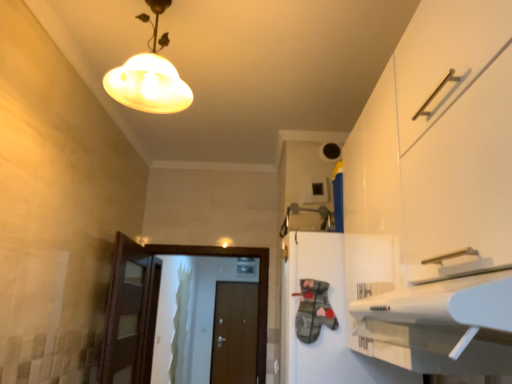
What is the approximate height of white matte cabinet at center?

It is 29.87 inches.

At what (x,y) coordinates should I click in order to perform the action: click on white matte cabinet at center. Please return your answer as a coordinate pair (x, y). Image resolution: width=512 pixels, height=384 pixels. Looking at the image, I should click on (325, 325).

Locate an element on the screen. matte glass lampshade at upper center is located at coordinates (149, 75).

Is white matte cabinet at center taller than white glossy door at center, which ranks as the first door in top-to-bottom order?

In fact, white matte cabinet at center may be shorter than white glossy door at center, which ranks as the first door in top-to-bottom order.

From the image's perspective, is white matte cabinet at center beneath white glossy door at center, placed as the 1th door when sorted from front to back?

No, from the image's perspective, white matte cabinet at center is not below white glossy door at center, placed as the 1th door when sorted from front to back.

In terms of size, does white matte cabinet at center appear bigger or smaller than white glossy door at center, which ranks as the first door in top-to-bottom order?

In the image, white matte cabinet at center appears to be larger than white glossy door at center, which ranks as the first door in top-to-bottom order.

Which object is closer to the camera, white matte cabinet at center or white glossy door at center, placed as the 1th door when sorted from front to back?

white matte cabinet at center is more forward.

Does point (223, 344) come farther from viewer compared to point (301, 353)?

Yes, point (223, 344) is farther from viewer.

Is brown matte door at center, which is the second door in front-to-back order, positioned with its back to white matte cabinet at center?

No, brown matte door at center, which is the second door in front-to-back order, is not facing the opposite direction of white matte cabinet at center.

Could you measure the distance between brown matte door at center, which is the second door in front-to-back order, and white matte cabinet at center?

brown matte door at center, which is the second door in front-to-back order, is 4.75 meters from white matte cabinet at center.

Is brown matte door at center, marked as the 1th door in a bottom-to-top arrangement, inside the boundaries of white matte cabinet at center, or outside?

The correct answer is: outside.

Is white matte cabinet at center with brown matte door at center, marked as the 1th door in a bottom-to-top arrangement?

white matte cabinet at center is not next to brown matte door at center, marked as the 1th door in a bottom-to-top arrangement, and they're not touching.

How many degrees apart are the facing directions of white matte cabinet at center and brown matte door at center, which appears as the first door when viewed from the back?

89.6 degrees separate the facing orientations of white matte cabinet at center and brown matte door at center, which appears as the first door when viewed from the back.

Which object is closer to the camera, white matte cabinet at center or brown matte door at center, marked as the 1th door in a bottom-to-top arrangement?

white matte cabinet at center is in front.

Which is closer, (374, 236) or (255, 331)?

Point (374, 236) appears to be closer to the viewer than point (255, 331).

Based on their sizes in the image, would you say white glossy door at center, which ranks as the first door in top-to-bottom order, is bigger or smaller than brown matte door at center, which appears as the first door when viewed from the back?

Considering their sizes, white glossy door at center, which ranks as the first door in top-to-bottom order, takes up less space than brown matte door at center, which appears as the first door when viewed from the back.

Identify the location of door on the right of the white glossy door at center, placed as the second door when sorted from bottom to top. [x=234, y=333].

Is there a large distance between white glossy door at center, which ranks as the first door in top-to-bottom order, and brown matte door at center, arranged as the 2th door when viewed from the top?

Yes, white glossy door at center, which ranks as the first door in top-to-bottom order, is far from brown matte door at center, arranged as the 2th door when viewed from the top.

Considering their positions, is brown matte door at center, arranged as the 2th door when viewed from the top, located in front of or behind white glossy door at center, placed as the second door when sorted from bottom to top?

Clearly, brown matte door at center, arranged as the 2th door when viewed from the top, is behind white glossy door at center, placed as the second door when sorted from bottom to top.

Can you confirm if brown matte door at center, arranged as the 2th door when viewed from the top, is positioned to the left of white glossy door at center, placed as the 1th door when sorted from front to back?

No, brown matte door at center, arranged as the 2th door when viewed from the top, is not to the left of white glossy door at center, placed as the 1th door when sorted from front to back.

In terms of width, does brown matte door at center, which is the second door in front-to-back order, look wider or thinner when compared to white glossy door at center, which ranks as the first door in top-to-bottom order?

Clearly, brown matte door at center, which is the second door in front-to-back order, has less width compared to white glossy door at center, which ranks as the first door in top-to-bottom order.

Would you say brown matte door at center, which is the second door in front-to-back order, is outside white glossy door at center, the 2th door positioned from the back?

brown matte door at center, which is the second door in front-to-back order, is positioned outside white glossy door at center, the 2th door positioned from the back.

Considering the sizes of objects white glossy door at center, placed as the 1th door when sorted from front to back, and matte glass lampshade at upper center in the image provided, who is shorter, white glossy door at center, placed as the 1th door when sorted from front to back, or matte glass lampshade at upper center?

matte glass lampshade at upper center is shorter.

Is white glossy door at center, placed as the second door when sorted from bottom to top, inside the boundaries of matte glass lampshade at upper center, or outside?

white glossy door at center, placed as the second door when sorted from bottom to top, exists outside the volume of matte glass lampshade at upper center.

Looking at this image, considering the sizes of objects white glossy door at center, placed as the second door when sorted from bottom to top, and matte glass lampshade at upper center in the image provided, who is wider, white glossy door at center, placed as the second door when sorted from bottom to top, or matte glass lampshade at upper center?

Wider between the two is matte glass lampshade at upper center.

Looking at this image, considering the sizes of white glossy door at center, the 2th door positioned from the back, and matte glass lampshade at upper center in the image, is white glossy door at center, the 2th door positioned from the back, bigger or smaller than matte glass lampshade at upper center?

Clearly, white glossy door at center, the 2th door positioned from the back, is larger in size than matte glass lampshade at upper center.

Which is less distant, (x=148, y=111) or (x=148, y=346)?

Point (x=148, y=111) is closer to the camera than point (x=148, y=346).

Is white glossy door at center, placed as the 1th door when sorted from front to back, a part of matte glass lampshade at upper center?

No, matte glass lampshade at upper center does not contain white glossy door at center, placed as the 1th door when sorted from front to back.

Is matte glass lampshade at upper center positioned in front of white glossy door at center, placed as the 1th door when sorted from front to back?

Yes, it is.

Does matte glass lampshade at upper center touch white glossy door at center, which ranks as the first door in top-to-bottom order?

matte glass lampshade at upper center is not next to white glossy door at center, which ranks as the first door in top-to-bottom order, and they're not touching.

Where is `cabinetry above the white glossy door at center, which ranks as the first door in top-to-bottom order (from the image's perspective)`? cabinetry above the white glossy door at center, which ranks as the first door in top-to-bottom order (from the image's perspective) is located at coordinates (325, 325).

Identify the location of cabinetry in front of the brown matte door at center, which is the second door in front-to-back order. This screenshot has height=384, width=512. (325, 325).

Which object lies further to the anchor point white matte cabinet at center, white glossy door at center, placed as the 1th door when sorted from front to back, or matte glass lampshade at upper center?

white glossy door at center, placed as the 1th door when sorted from front to back, is positioned further to the anchor white matte cabinet at center.

Which object lies nearer to the anchor point matte glass lampshade at upper center, brown matte door at center, marked as the 1th door in a bottom-to-top arrangement, or white matte cabinet at center?

white matte cabinet at center is closer to matte glass lampshade at upper center.

Estimate the real-world distances between objects in this image. Which object is closer to brown matte door at center, arranged as the 2th door when viewed from the top, matte glass lampshade at upper center or white glossy door at center, the 2th door positioned from the back?

white glossy door at center, the 2th door positioned from the back, is closer to brown matte door at center, arranged as the 2th door when viewed from the top.

Estimate the real-world distances between objects in this image. Which object is closer to white matte cabinet at center, brown matte door at center, marked as the 1th door in a bottom-to-top arrangement, or white glossy door at center, placed as the 1th door when sorted from front to back?

The object closer to white matte cabinet at center is white glossy door at center, placed as the 1th door when sorted from front to back.

Based on their spatial positions, is brown matte door at center, which appears as the first door when viewed from the back, or white matte cabinet at center closer to white glossy door at center, placed as the 1th door when sorted from front to back?

white matte cabinet at center is closer to white glossy door at center, placed as the 1th door when sorted from front to back.

Looking at this image, which object lies nearer to the anchor point brown matte door at center, marked as the 1th door in a bottom-to-top arrangement, white matte cabinet at center or white glossy door at center, which ranks as the first door in top-to-bottom order?

white glossy door at center, which ranks as the first door in top-to-bottom order, is closer to brown matte door at center, marked as the 1th door in a bottom-to-top arrangement.

Considering their positions, is matte glass lampshade at upper center positioned closer to white glossy door at center, the 2th door positioned from the back, than brown matte door at center, which appears as the first door when viewed from the back?

Based on the image, matte glass lampshade at upper center appears to be nearer to white glossy door at center, the 2th door positioned from the back.

Based on their spatial positions, is white matte cabinet at center or matte glass lampshade at upper center closer to white glossy door at center, the 2th door positioned from the back?

Among the two, white matte cabinet at center is located nearer to white glossy door at center, the 2th door positioned from the back.

Find the location of `door between matte glass lampshade at upper center and brown matte door at center, marked as the 1th door in a bottom-to-top arrangement, along the z-axis`. door between matte glass lampshade at upper center and brown matte door at center, marked as the 1th door in a bottom-to-top arrangement, along the z-axis is located at coordinates (157, 304).

In order to click on door between white matte cabinet at center and brown matte door at center, marked as the 1th door in a bottom-to-top arrangement, from front to back in this screenshot , I will do `click(157, 304)`.

This screenshot has height=384, width=512. In order to click on cabinetry located between matte glass lampshade at upper center and brown matte door at center, marked as the 1th door in a bottom-to-top arrangement, in the depth direction in this screenshot , I will do `click(325, 325)`.

Identify the location of cabinetry located between matte glass lampshade at upper center and white glossy door at center, which ranks as the first door in top-to-bottom order, in the depth direction. (325, 325).